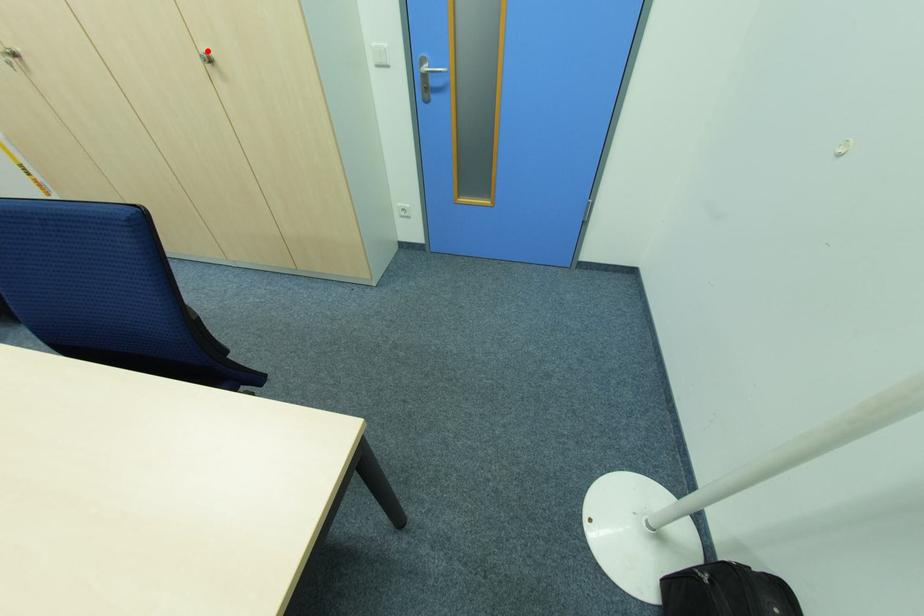
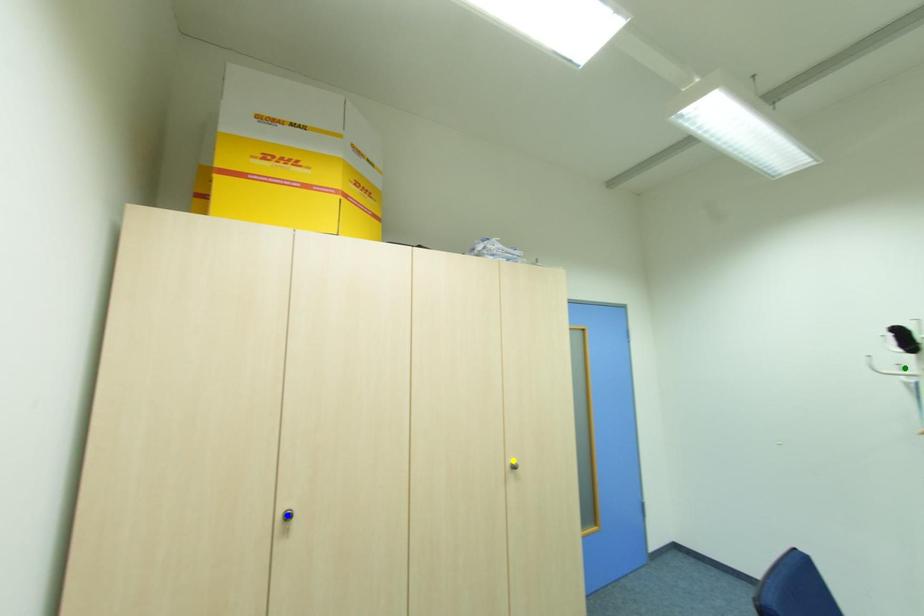
Question: I am providing you with two images of the same scene from different viewpoints. A red point is marked on the first image. You are given multiple points on the second image. Which point in image 2 is actually the same real-world point as the red point in image 1?

Choices:
 (A) green point
 (B) yellow point
 (C) blue point

Answer: (B)